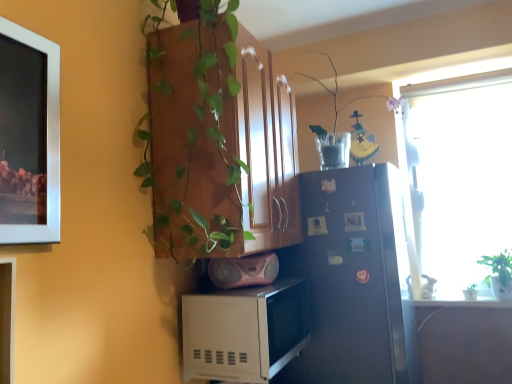
Question: From the image's perspective, is clear glass vase at upper right positioned above or below wooden cabinet at upper center?

Choices:
 (A) below
 (B) above

Answer: (B)

Question: Is clear glass vase at upper right wider or thinner than wooden cabinet at upper center?

Choices:
 (A) wide
 (B) thin

Answer: (B)

Question: Which is nearer to the wooden cabinet at upper center?

Choices:
 (A) clear glass vase at upper right
 (B) satin black refrigerator at right
 (C) green leafy plant at right
 (D) white matte microwave at lower center
 (E) pink matte speaker at center

Answer: (E)

Question: Estimate the real-world distances between objects in this image. Which object is closer to the clear glass vase at upper right?

Choices:
 (A) wooden cabinet at upper center
 (B) green leafy plant at right
 (C) satin black refrigerator at right
 (D) pink matte speaker at center
 (E) white matte microwave at lower center

Answer: (C)